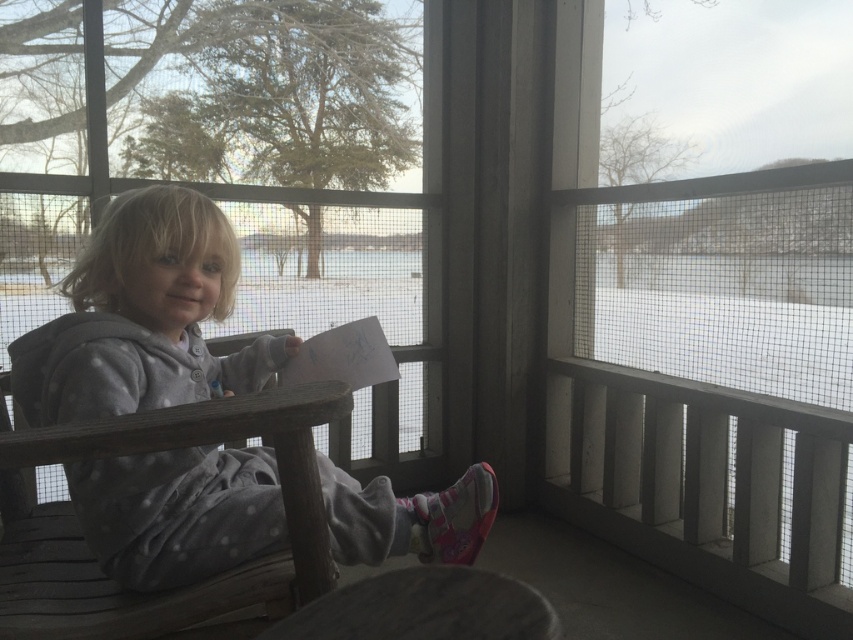
Which of these two, white mesh screen door at center or wooden chair at center, stands shorter?

Standing shorter between the two is wooden chair at center.

Measure the distance between point (576, 92) and camera.

Point (576, 92) and camera are 8.95 feet apart from each other.

Find the location of `white mesh screen door at center`. white mesh screen door at center is located at coordinates (701, 364).

Is point (579, 28) farther from camera compared to point (161, 385)?

Yes, point (579, 28) is farther from viewer.

Looking at this image, which is more to the left, white mesh screen door at center or gray fleece hoodie at center?

gray fleece hoodie at center is more to the left.

Between point (583, 282) and point (148, 301), which one is positioned behind?

Point (583, 282)

Locate an element on the screen. Image resolution: width=853 pixels, height=640 pixels. white mesh screen door at center is located at coordinates (701, 364).

Who is more forward, [138,340] or [148,442]?

Point [148,442]

Between gray fleece hoodie at center and wooden chair at center, which one is positioned lower?

wooden chair at center

Is point (83, 362) farther from camera compared to point (39, 588)?

No.

Locate an element on the screen. gray fleece hoodie at center is located at coordinates (142, 317).